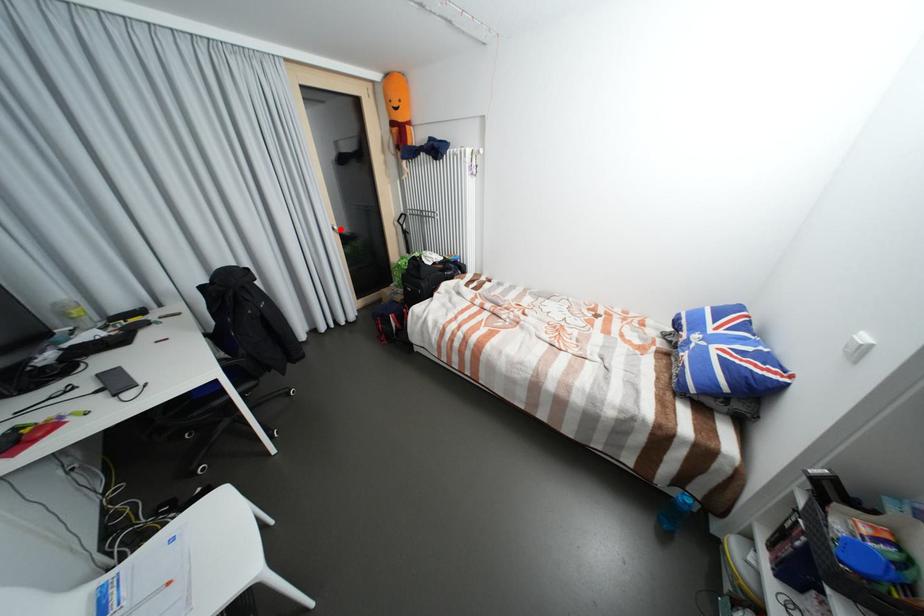
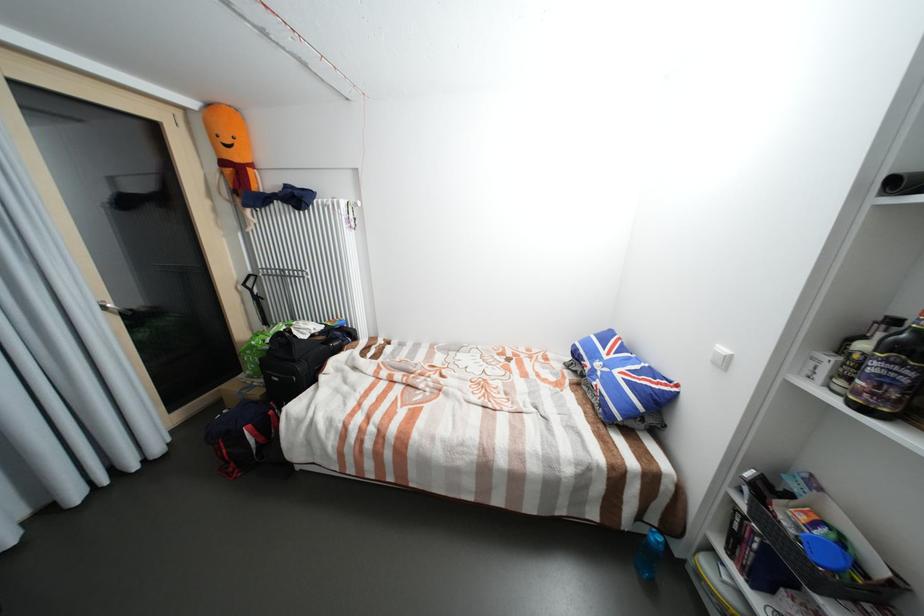
Locate, in the second image, the point that corresponds to the highlighted location in the first image.

(112, 308)